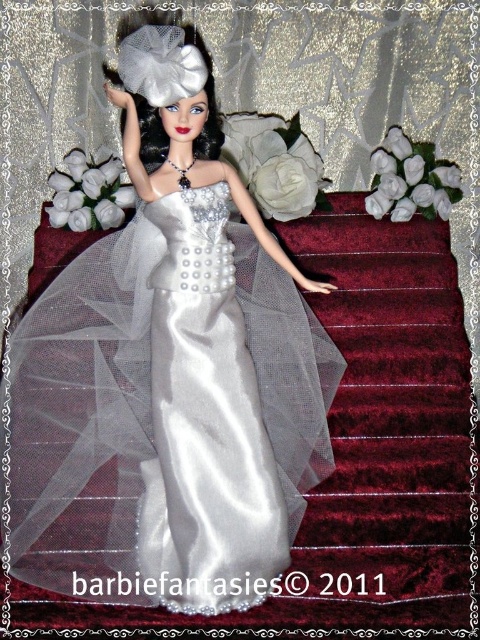
Is point (124, 532) positioned after point (196, 548)?

Yes, point (124, 532) is farther from viewer.

I want to click on satin dress at center, so click(x=168, y=376).